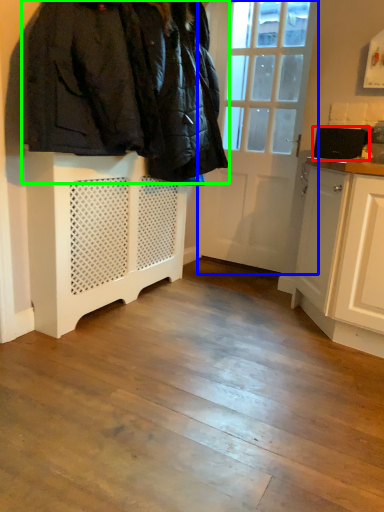
Question: Which object is positioned farthest from appliance (highlighted by a red box)? Select from door (highlighted by a blue box) and furniture (highlighted by a green box).

Choices:
 (A) door
 (B) furniture

Answer: (B)